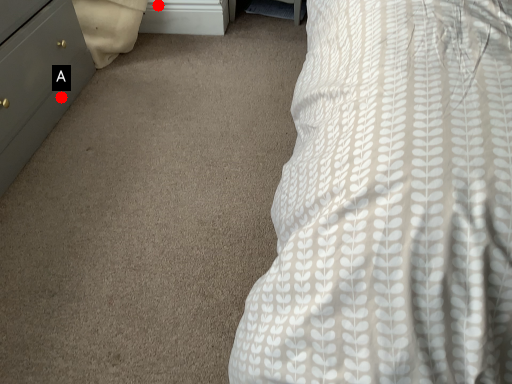
Question: Two points are circled on the image, labeled by A and B beside each circle. Which point appears farthest from the camera in this image?

Choices:
 (A) A is further
 (B) B is further

Answer: (B)